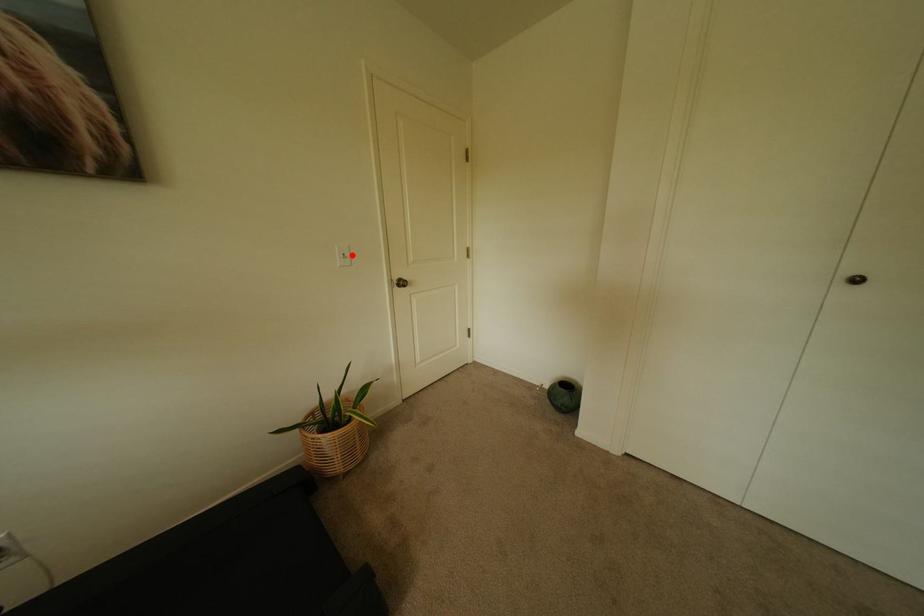
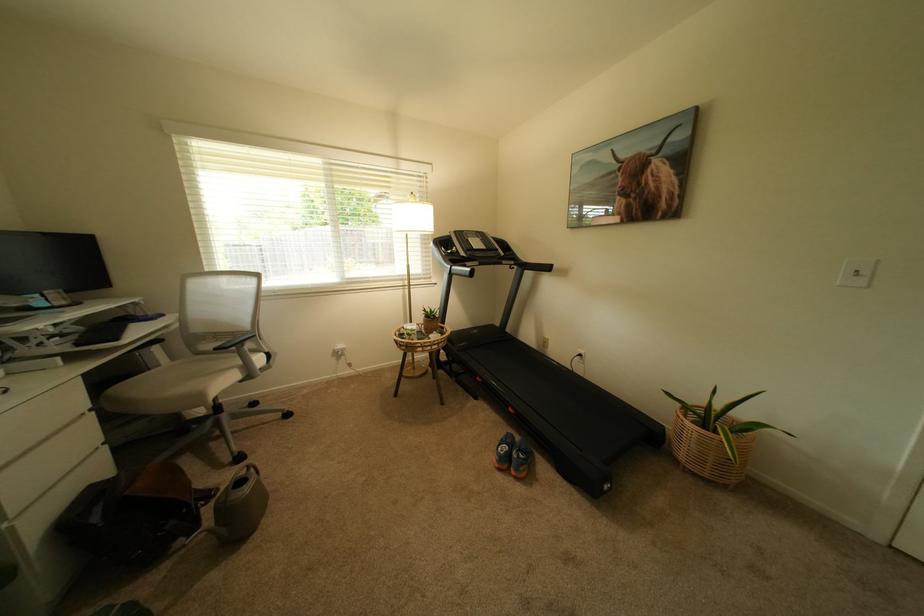
Where in the second image is the point corresponding to the highlighted location from the first image?

(866, 272)